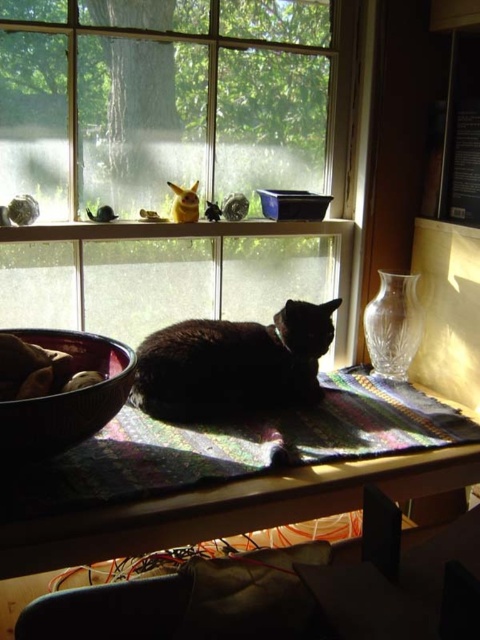
Question: Which point is closer to the camera taking this photo?

Choices:
 (A) (100, 497)
 (B) (38, 406)
 (C) (199, 348)
 (D) (272, 131)

Answer: (B)

Question: Is multicolored woven mat at center further to the viewer compared to brown matte bowl at lower left?

Choices:
 (A) no
 (B) yes

Answer: (B)

Question: Among these points, which one is nearest to the camera?

Choices:
 (A) (358, 426)
 (B) (325, 337)

Answer: (A)

Question: Which object is positioned closest to the multicolored woven mat at center?

Choices:
 (A) black fur cat at center
 (B) brown matte bowl at lower left

Answer: (A)

Question: Does black fur cat at center appear under brown matte bowl at lower left?

Choices:
 (A) no
 (B) yes

Answer: (A)

Question: Can you confirm if multicolored woven mat at center is bigger than brown matte bowl at lower left?

Choices:
 (A) yes
 (B) no

Answer: (A)